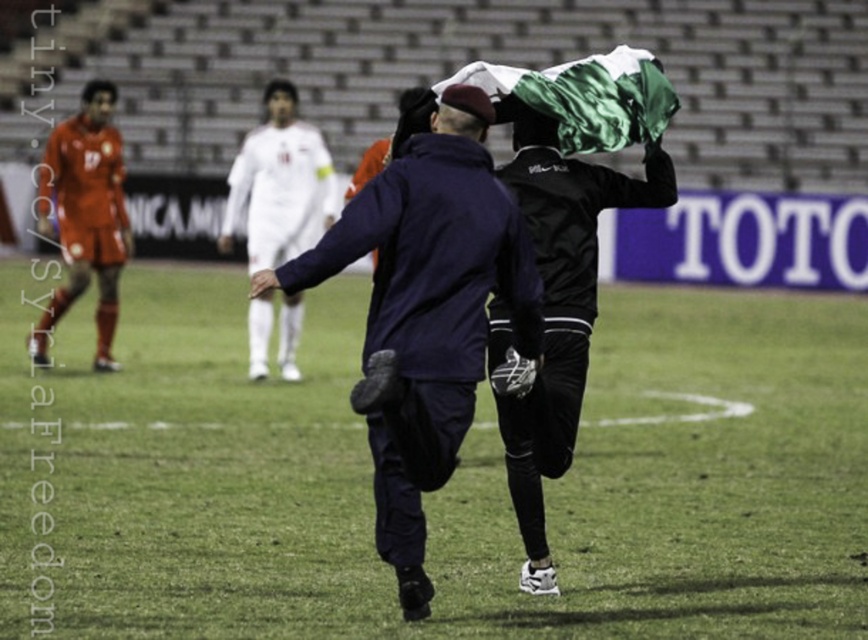
From the picture: Does white smooth soccer ball at center appear under orange jersey at left?

Incorrect, white smooth soccer ball at center is not positioned below orange jersey at left.

Is white smooth soccer ball at center smaller than orange jersey at left?

Yes.

At what (x,y) coordinates should I click in order to perform the action: click on white smooth soccer ball at center. Please return your answer as a coordinate pair (x, y). Looking at the image, I should click on pos(278,180).

Measure the distance between dark blue jacket at center and white smooth soccer ball at center.

dark blue jacket at center and white smooth soccer ball at center are 8.24 meters apart.

Image resolution: width=868 pixels, height=640 pixels. What do you see at coordinates (425, 310) in the screenshot?
I see `dark blue jacket at center` at bounding box center [425, 310].

Identify the location of dark blue jacket at center. (425, 310).

Describe the element at coordinates (559, 308) in the screenshot. I see `black matte jacket at center` at that location.

Where is `black matte jacket at center`? black matte jacket at center is located at coordinates (559, 308).